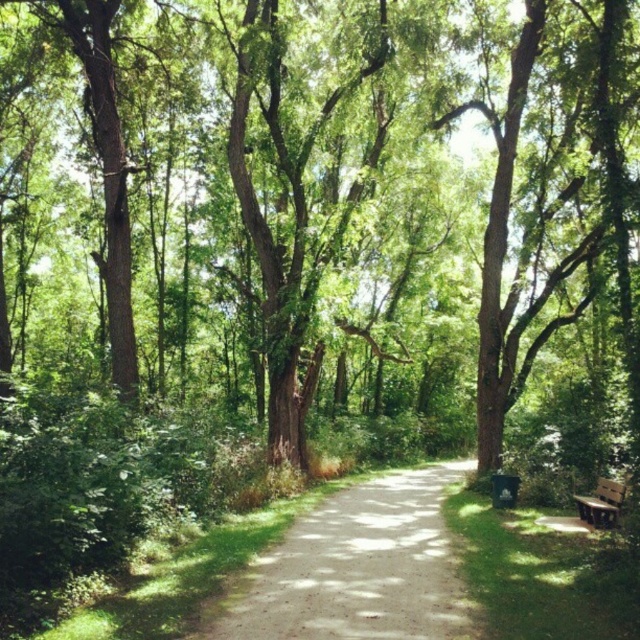
Describe the element at coordinates (356, 568) in the screenshot. This screenshot has width=640, height=640. I see `dirt/gravel path at center` at that location.

Which of these two, dirt/gravel path at center or brown wooden bench at lower right, stands shorter?

With less height is brown wooden bench at lower right.

The width and height of the screenshot is (640, 640). I want to click on dirt/gravel path at center, so click(x=356, y=568).